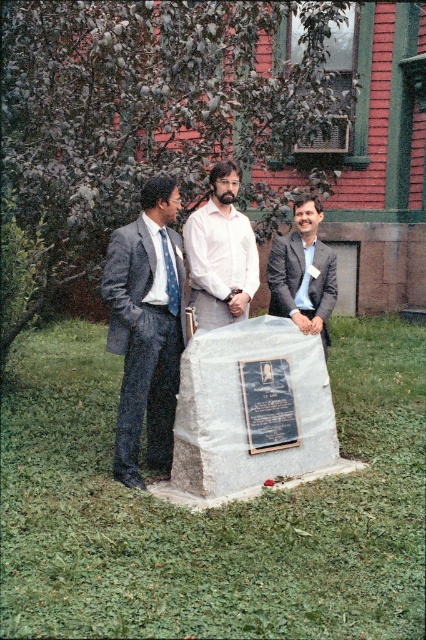
You are a photographer trying to capture a group photo of the gray textured suit at left and the white cotton shirt at center. Since you want to ensure both subjects are in focus, you need to know their heights. Which person is taller?

The gray textured suit at left is taller than the white cotton shirt at center.

You are a surveyor trying to locate a specific point marked on a map. The point has coordinates of (252,406). You are currently standing in front of a red brick building with green framed windows where three men are standing. According to the image, where is this point located?

The point is located on the gray stone monument at center.